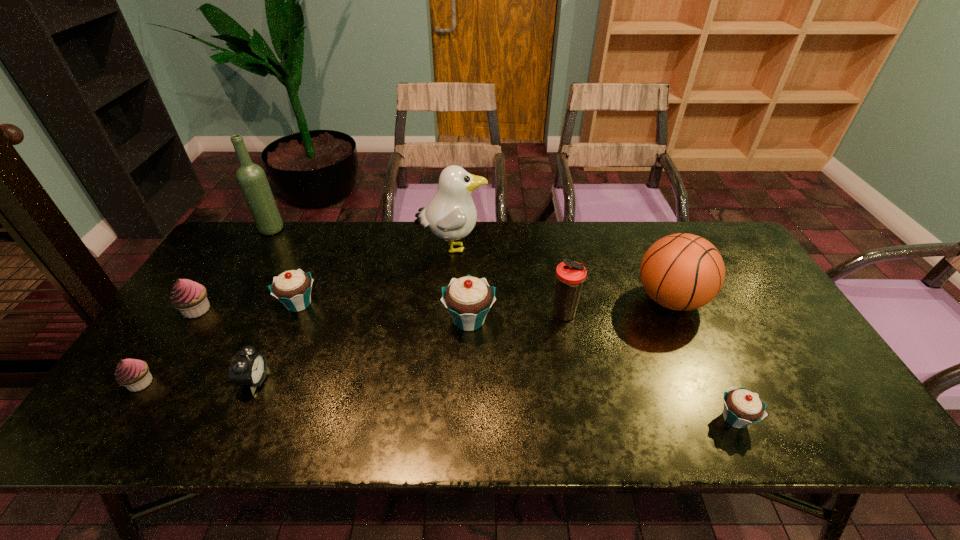
I want to click on free location located 0.370m on the right of the tallest cupcake, so click(x=630, y=320).

The height and width of the screenshot is (540, 960). Identify the location of vacant space positioned on the back of the leftmost teal cupcake. (323, 247).

The image size is (960, 540). I want to click on blank space located 0.050m on the right of the farther pink cupcake, so click(x=230, y=310).

Find the location of a particular element. Image resolution: width=960 pixels, height=540 pixels. vacant space located on the front side of the alarm clock is located at coordinates (316, 381).

What are the coordinates of `vacant space located 0.250m on the right of the nearer pink cupcake` in the screenshot? It's located at [x=258, y=383].

Find the location of `vacant space situated on the right of the nearest object`. vacant space situated on the right of the nearest object is located at coordinates (844, 418).

Image resolution: width=960 pixels, height=540 pixels. What are the coordinates of `wine bottle that is at the far edge` in the screenshot? It's located at (252, 179).

Where is `gull present at the far edge`? This screenshot has width=960, height=540. gull present at the far edge is located at coordinates (451, 214).

This screenshot has width=960, height=540. I want to click on object that is positioned at the near edge, so click(x=741, y=407).

The width and height of the screenshot is (960, 540). In order to click on wine bottle at the left edge in this screenshot , I will do `click(252, 179)`.